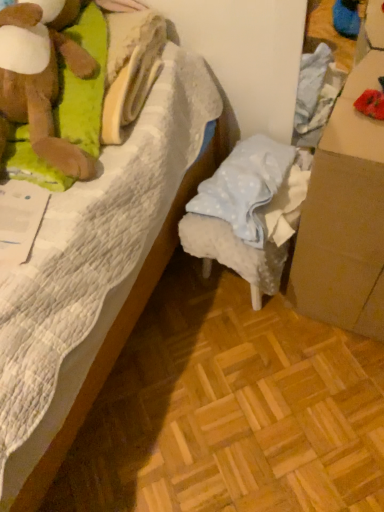
Question: From a real-world perspective, is brown cardboard box at right above or below white quilted bed at center?

Choices:
 (A) below
 (B) above

Answer: (A)

Question: Is point (332, 198) positioned closer to the camera than point (59, 210)?

Choices:
 (A) farther
 (B) closer

Answer: (B)

Question: Which is nearer to the white quilted bed at center?

Choices:
 (A) brown cardboard box at right
 (B) light blue fabric stool at center

Answer: (B)

Question: Which object is the closest to the light blue fabric stool at center?

Choices:
 (A) white quilted bed at center
 (B) brown cardboard box at right

Answer: (B)